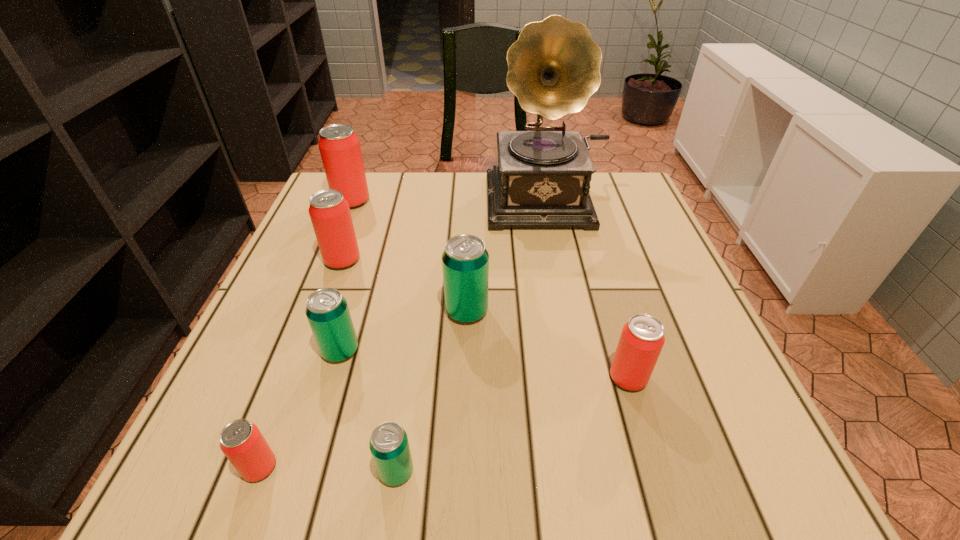
Where is `the second nearest teal beer can`? The width and height of the screenshot is (960, 540). the second nearest teal beer can is located at coordinates (327, 311).

Identify the location of the leftmost teal beer can. (327, 311).

The image size is (960, 540). Identify the location of the smallest teal beer can. (389, 446).

The height and width of the screenshot is (540, 960). Find the location of `the fifth beer can from left to right`. the fifth beer can from left to right is located at coordinates (389, 446).

Locate an element on the screen. Image resolution: width=960 pixels, height=540 pixels. the smallest red beer can is located at coordinates (241, 441).

You are a GUI agent. You are given a task and a screenshot of the screen. Output one action in this format:
    pyautogui.click(x=<x>, y=<y>)
    Task: Click on the free space located on the horn of the record player
    The image size is (960, 540).
    Given the screenshot: What is the action you would take?
    pyautogui.click(x=566, y=274)

Locate an element on the screen. This screenshot has height=540, width=960. blank space located 0.100m on the front of the farthest red beer can is located at coordinates (339, 234).

This screenshot has width=960, height=540. What are the coordinates of `vacant space situated on the back of the second farthest beer can` in the screenshot? It's located at (366, 195).

Identify the location of vacant space located on the front of the farthest teal beer can. The width and height of the screenshot is (960, 540). (466, 352).

Identify the location of blank space located 0.130m on the left of the rightmost beer can. The width and height of the screenshot is (960, 540). (x=535, y=377).